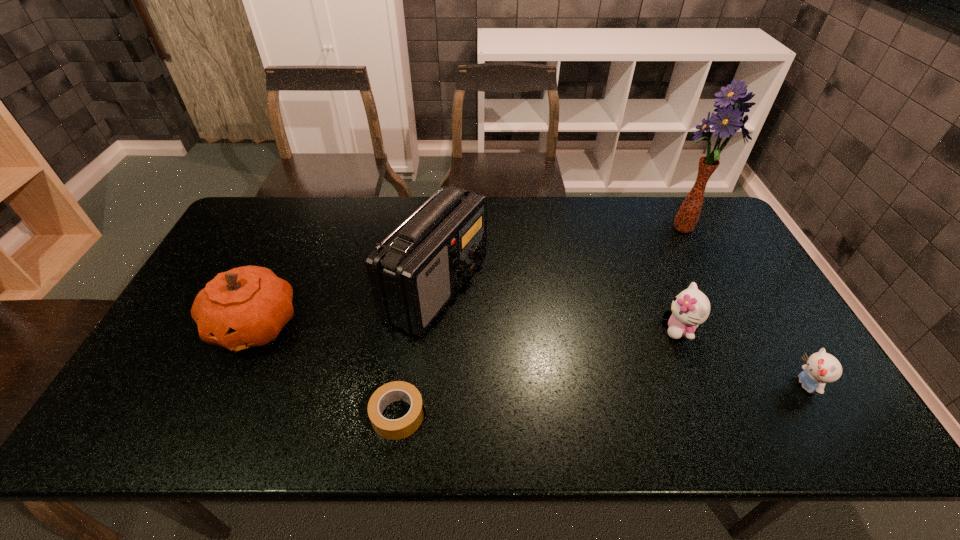
Locate an element on the screen. The image size is (960, 540). object at the near edge is located at coordinates (397, 429).

Image resolution: width=960 pixels, height=540 pixels. I want to click on object at the left edge, so click(248, 306).

The width and height of the screenshot is (960, 540). What are the coordinates of `flower arrangement present at the right edge` in the screenshot? It's located at (729, 119).

I want to click on kitten that is positioned at the right edge, so click(x=821, y=368).

Identify the location of object that is at the far right corner. (729, 119).

You are a GUI agent. You are given a task and a screenshot of the screen. Output one action in this format:
    pyautogui.click(x=<x>, y=<y>)
    Task: Click on the vacant space at the far edge of the desktop
    Image resolution: width=960 pixels, height=540 pixels.
    Given the screenshot: What is the action you would take?
    pyautogui.click(x=607, y=201)

Locate an element on the screen. Image resolution: width=960 pixels, height=540 pixels. vacant region at the near edge of the desktop is located at coordinates (735, 417).

In the image, there is a desktop. Identify the location of vacant space at the left edge. The width and height of the screenshot is (960, 540). (159, 379).

The height and width of the screenshot is (540, 960). I want to click on vacant space at the right edge of the desktop, so click(x=750, y=337).

You are a GUI agent. You are given a task and a screenshot of the screen. Output one action in this format:
    pyautogui.click(x=<x>, y=<y>)
    Task: Click on the free space at the far left corner of the desktop
    
    Given the screenshot: What is the action you would take?
    pyautogui.click(x=275, y=224)